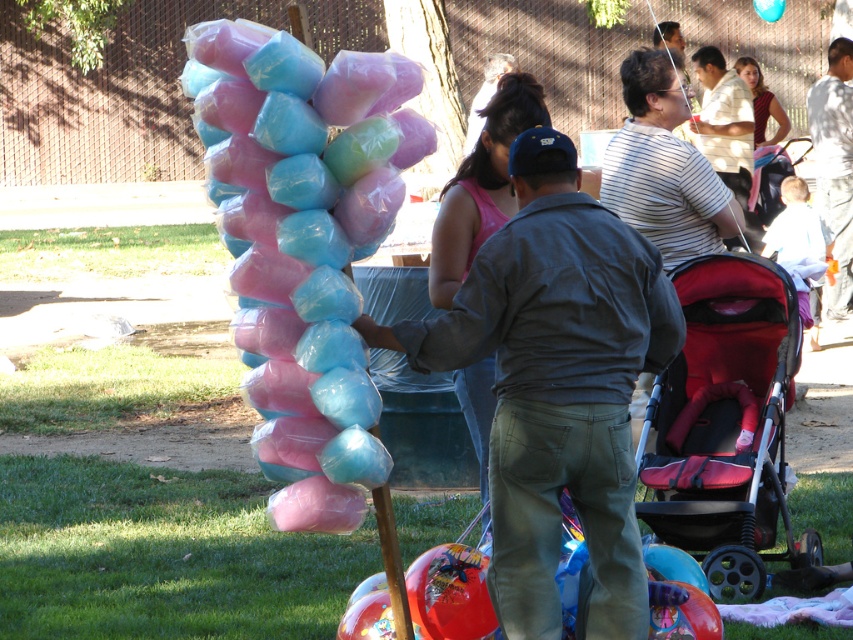
Question: Observing the image, what is the correct spatial positioning of pastel cotton candy at center in reference to light brown fabric baby stroller at right?

Choices:
 (A) right
 (B) left

Answer: (B)

Question: Is pastel cotton candy at center wider than light brown fabric baby stroller at right?

Choices:
 (A) yes
 (B) no

Answer: (B)

Question: Which point appears farthest from the camera in this image?

Choices:
 (A) (764, 13)
 (B) (511, 68)
 (C) (363, 204)
 (D) (744, 77)

Answer: (A)

Question: Among these objects, which one is farthest from the camera?

Choices:
 (A) pink fabric shirt at center
 (B) pastel cotton candy at center
 (C) dark gray shirt at center
 (D) smooth brown shirt at center

Answer: (C)

Question: Among these objects, which one is farthest from the camera?

Choices:
 (A) velvet-like beige vest at upper right
 (B) light brown fabric baby stroller at right
 (C) blue glossy balloon at center

Answer: (C)

Question: Does matte gray shirt at center appear on the right side of smooth brown shirt at center?

Choices:
 (A) no
 (B) yes

Answer: (A)